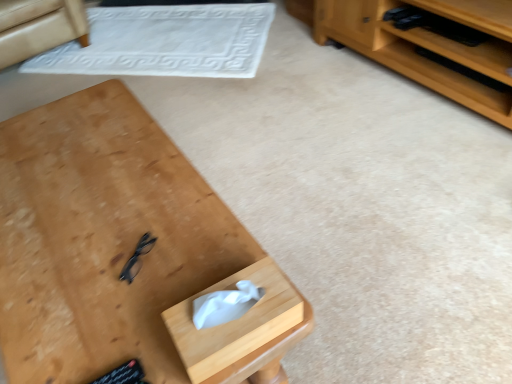
The height and width of the screenshot is (384, 512). In order to click on vacant area in front of white textured mat at upper center in this screenshot , I will do `click(233, 119)`.